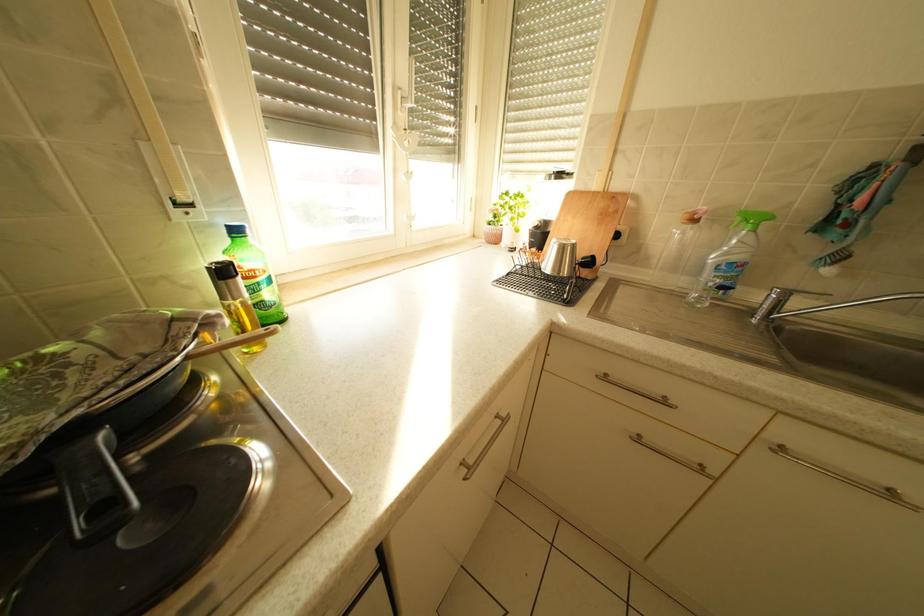
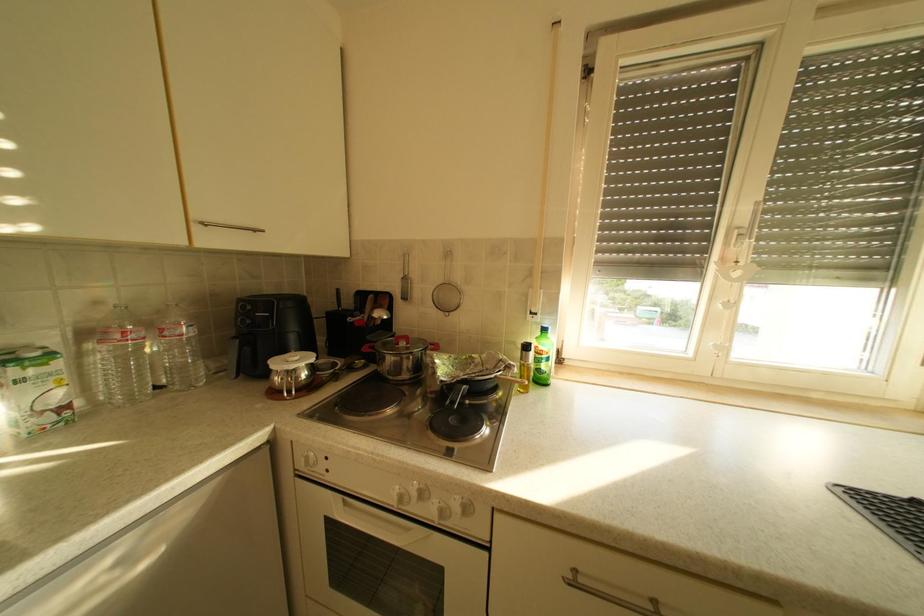
Question: Based on the continuous images, in which direction is the camera rotating? Reply with the corresponding letter.

Choices:
 (A) Left
 (B) Right
 (C) Up
 (D) Down

Answer: (A)